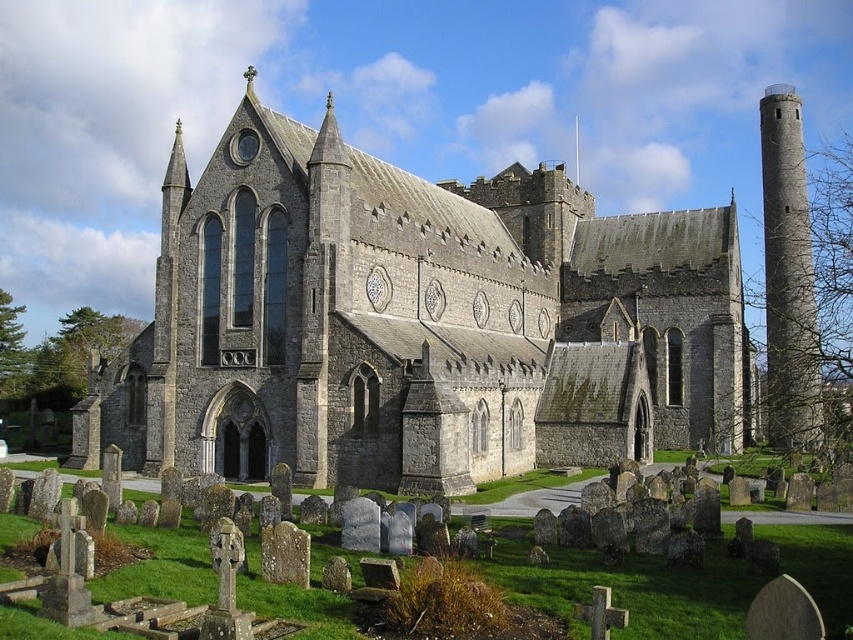
Does point (769, 125) come behind point (578, 131)?

No, it is in front of (578, 131).

Who is lower down, gray stone tower at right or silver metallic spire at upper center?

Positioned lower is gray stone tower at right.

Between point (791, 244) and point (576, 120), which one is positioned in front?

Point (791, 244) is more forward.

At what (x,y) coordinates should I click in order to perform the action: click on gray stone tower at right. Please return your answer as a coordinate pair (x, y). This screenshot has height=640, width=853. Looking at the image, I should click on (788, 276).

Does gray stone church at center have a lesser width compared to gray stone tower at right?

Yes.

Between point (440, 243) and point (778, 355), which one is positioned behind?

Point (778, 355)

What do you see at coordinates (415, 323) in the screenshot? I see `gray stone church at center` at bounding box center [415, 323].

At what (x,y) coordinates should I click in order to perform the action: click on gray stone church at center. Please return your answer as a coordinate pair (x, y). The height and width of the screenshot is (640, 853). Looking at the image, I should click on 415,323.

Is point (259, 182) less distant than point (578, 156)?

Yes, point (259, 182) is in front of point (578, 156).

Who is lower down, gray stone church at center or silver metallic spire at upper center?

gray stone church at center is below.

Is point (546, 237) farther from camera compared to point (575, 118)?

That is False.

This screenshot has width=853, height=640. What are the coordinates of `gray stone church at center` in the screenshot? It's located at (415, 323).